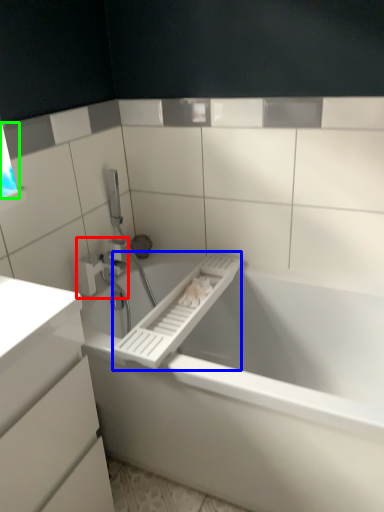
Question: Which object is positioned closest to tap (highlighted by a red box)? Select from towel bar (highlighted by a blue box) and window (highlighted by a green box).

Choices:
 (A) towel bar
 (B) window

Answer: (A)